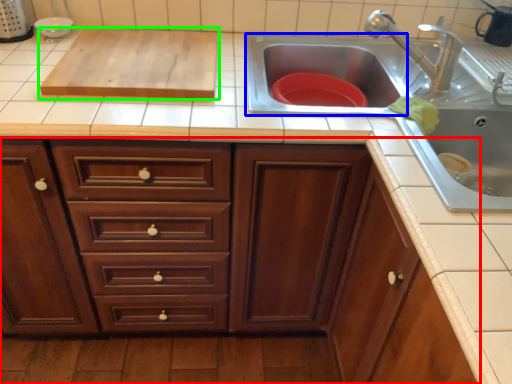
Question: Which is farther away from cabinetry (highlighted by a red box)? sink (highlighted by a blue box) or wide (highlighted by a green box)?

Choices:
 (A) sink
 (B) wide

Answer: (A)